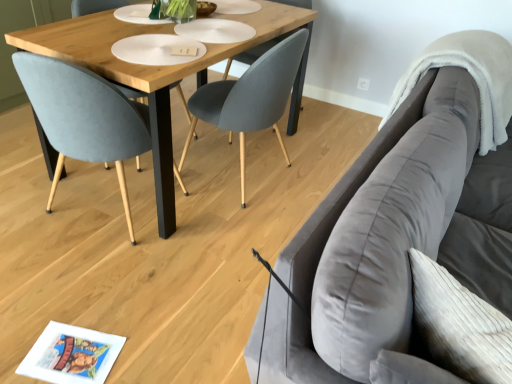
Locate an element on the screen. free space between velvet blue chair at center, which appears as the 1th chair when viewed from the left, and wooden table at center is located at coordinates (72, 216).